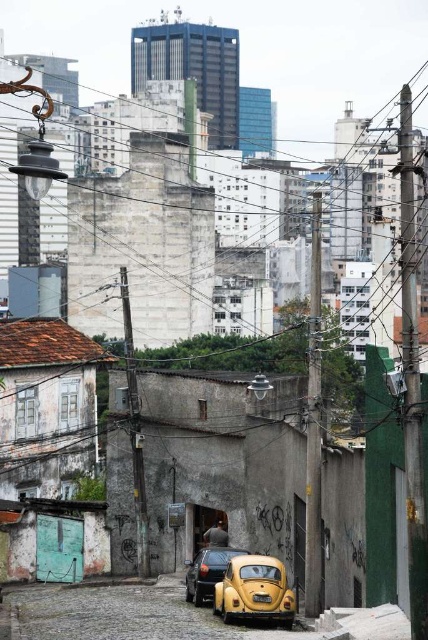
You are a pedestrian standing on the cobblestone street and want to take a photo of the yellow matte car at center. However, you notice the yellow matte license plate at center might be blocking your view. Is the license plate in front of or behind the car?

The yellow matte license plate at center is behind the yellow matte car at center because the car is further to the viewer than the license plate.